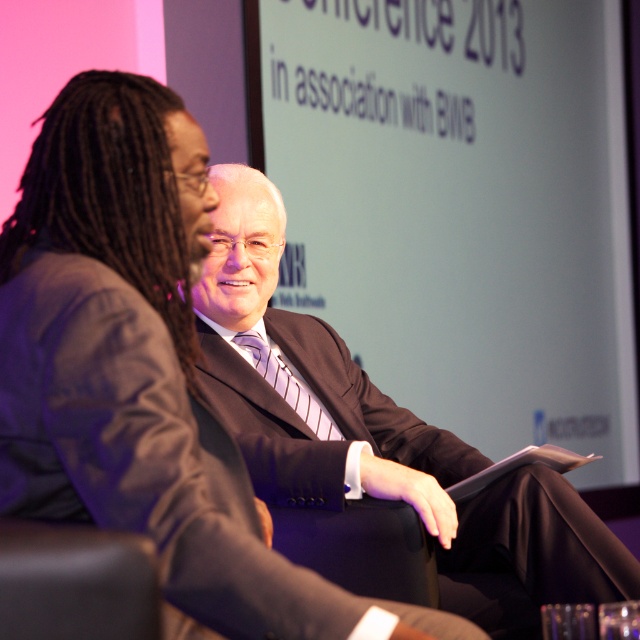
In the conference setting described, you need to arrange a name tag for the person wearing the matte black suit at center. Since the black leather chair at lower left is already occupied, where should you place the name tag relative to the chair?

The matte black suit at center is to the right of the black leather chair at lower left, so you should place the name tag to the right side of the black leather chair at lower left.